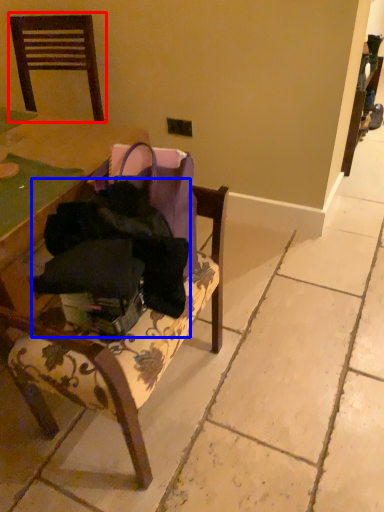
Question: Which object is closer to the camera taking this photo, chair (highlighted by a red box) or clothing (highlighted by a blue box)?

Choices:
 (A) chair
 (B) clothing

Answer: (B)